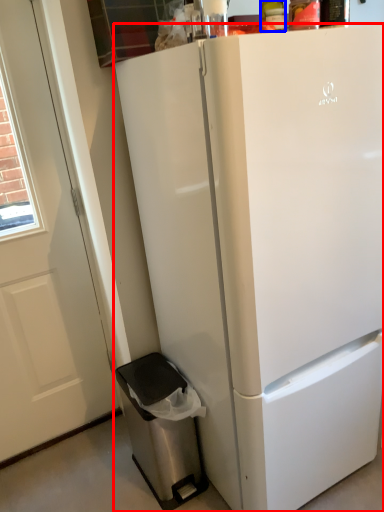
Question: Which object is further to the camera taking this photo, refrigerator (highlighted by a red box) or bottle (highlighted by a blue box)?

Choices:
 (A) refrigerator
 (B) bottle

Answer: (B)